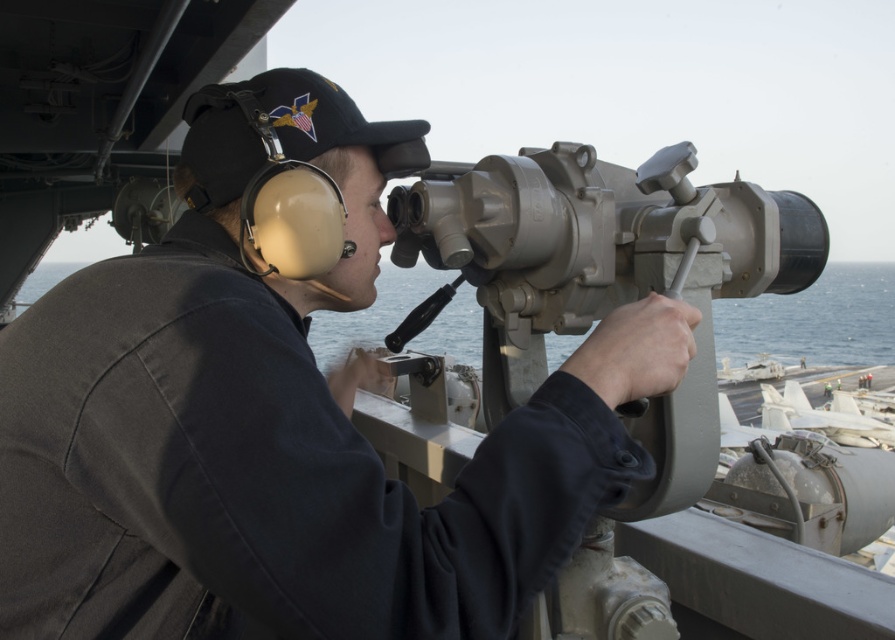
Can you confirm if matte black uniform at center is shorter than matte gray telescope at center?

Correct, matte black uniform at center is not as tall as matte gray telescope at center.

This screenshot has height=640, width=895. Find the location of `matte black uniform at center`. matte black uniform at center is located at coordinates (280, 422).